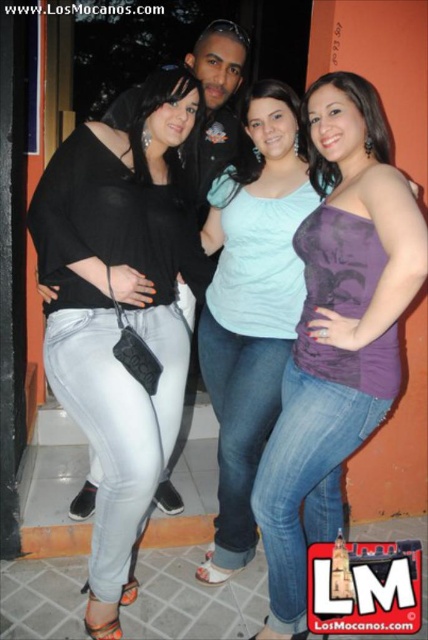
Question: Does black matte top at left have a greater width compared to purple matte tank top at center?

Choices:
 (A) yes
 (B) no

Answer: (A)

Question: Is the position of black matte top at left less distant than that of purple matte tank top at center?

Choices:
 (A) yes
 (B) no

Answer: (B)

Question: Among these objects, which one is nearest to the camera?

Choices:
 (A) purple matte tank top at center
 (B) black matte top at left

Answer: (A)

Question: Which point is farther to the camera?

Choices:
 (A) black matte top at left
 (B) purple matte tank top at center

Answer: (A)

Question: Is black matte top at left above purple matte tank top at center?

Choices:
 (A) yes
 (B) no

Answer: (A)